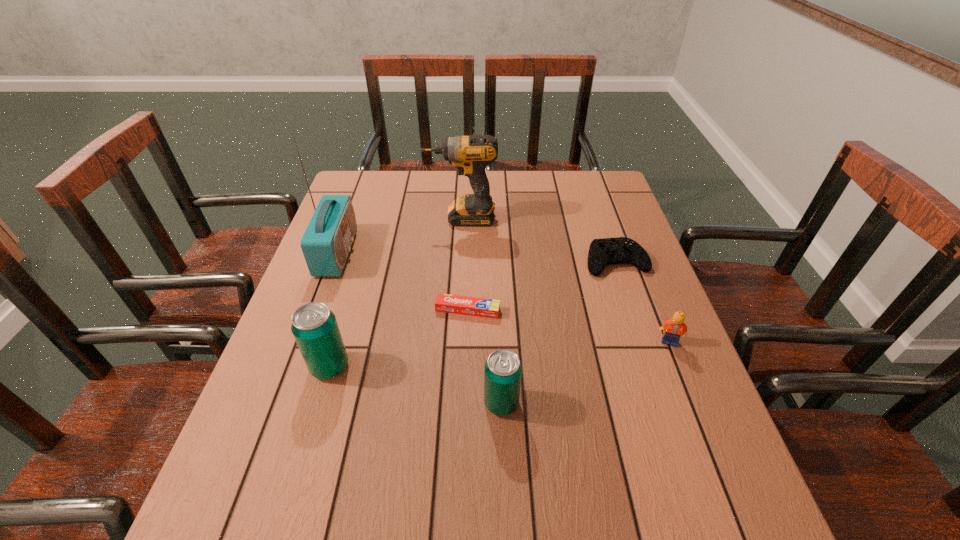
I want to click on vacant space at the far left corner of the desktop, so point(357,200).

You are a GUI agent. You are given a task and a screenshot of the screen. Output one action in this format:
    pyautogui.click(x=<x>, y=<y>)
    Task: Click on the free space at the far right corner of the desktop
    
    Given the screenshot: What is the action you would take?
    click(x=611, y=201)

You are a GUI agent. You are given a task and a screenshot of the screen. Output one action in this format:
    pyautogui.click(x=<x>, y=<y>)
    Task: Click on the vacant area that lies between the fifth shortest object and the nearer beer can
    
    Given the screenshot: What is the action you would take?
    pyautogui.click(x=416, y=384)

You are a GUI agent. You are given a task and a screenshot of the screen. Output one action in this format:
    pyautogui.click(x=<x>, y=<y>)
    Task: Click on the vacant space in between the nearer beer can and the second shortest object
    This screenshot has height=540, width=960.
    Given the screenshot: What is the action you would take?
    pyautogui.click(x=559, y=332)

Image resolution: width=960 pixels, height=540 pixels. What are the coordinates of `free space between the left beer can and the tallest object` in the screenshot? It's located at (333, 309).

Locate an element on the screen. This screenshot has height=540, width=960. free space between the drill and the sixth tallest object is located at coordinates 539,240.

Where is `vacant space that is in between the farther beer can and the toothpaste`? The width and height of the screenshot is (960, 540). vacant space that is in between the farther beer can and the toothpaste is located at coordinates (398, 338).

This screenshot has width=960, height=540. I want to click on free spot between the nearer beer can and the toothpaste, so click(x=485, y=356).

The height and width of the screenshot is (540, 960). What are the coordinates of `free space between the sixth tallest object and the toothpaste` in the screenshot? It's located at (541, 286).

The height and width of the screenshot is (540, 960). Identify the location of free spot between the nearest object and the Lego. (586, 372).